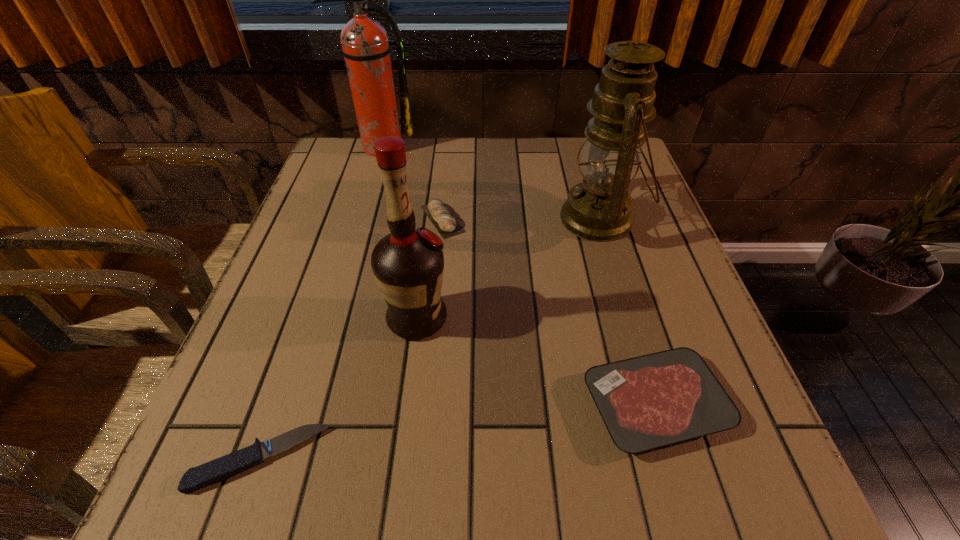
You are a GUI agent. You are given a task and a screenshot of the screen. Output one action in this format:
    pyautogui.click(x=<x>, y=<y>)
    Task: Click on the unoccupied area between the steak knife and the pita bread
    Image resolution: width=960 pixels, height=540 pixels.
    Given the screenshot: What is the action you would take?
    pyautogui.click(x=351, y=339)

Locate an element on the screen. Image resolution: width=960 pixels, height=540 pixels. free space between the pita bread and the farthest object is located at coordinates (411, 183).

Where is `vacant space that is in between the farthest object and the shortest object`? vacant space that is in between the farthest object and the shortest object is located at coordinates (321, 303).

Where is `vacant space that's between the fire extinguisher and the pita bread`? This screenshot has height=540, width=960. vacant space that's between the fire extinguisher and the pita bread is located at coordinates (411, 183).

Where is `vacant space that is in between the steak and the oil lamp`? This screenshot has width=960, height=540. vacant space that is in between the steak and the oil lamp is located at coordinates (628, 312).

Image resolution: width=960 pixels, height=540 pixels. Identify the location of object that is the second closest one to the farthest object. (599, 209).

Locate which object ranks third in proximity to the fire extinguisher. Please provide its 2D coordinates. Your answer should be formatted as a tuple, i.e. [(x, y)], where the tuple contains the x and y coordinates of a point satisfying the conditions above.

[(408, 265)]

Locate an element on the screen. Image resolution: width=960 pixels, height=540 pixels. vacant area that satisfies the following two spatial constraints: 1. on the front side of the fourth tallest object; 2. on the front and back of the liquor is located at coordinates (433, 319).

Find the location of a particular element. Image resolution: width=960 pixels, height=540 pixels. vacant space that satisfies the following two spatial constraints: 1. at the nozzle of the fire extinguisher; 2. on the left side of the oil lamp is located at coordinates (358, 219).

At what (x,y) coordinates should I click in order to perform the action: click on free space that satisfies the following two spatial constraints: 1. on the back side of the steak; 2. on the front and back of the fourth farthest object. Please return your answer as a coordinate pair (x, y). The height and width of the screenshot is (540, 960). Looking at the image, I should click on (630, 319).